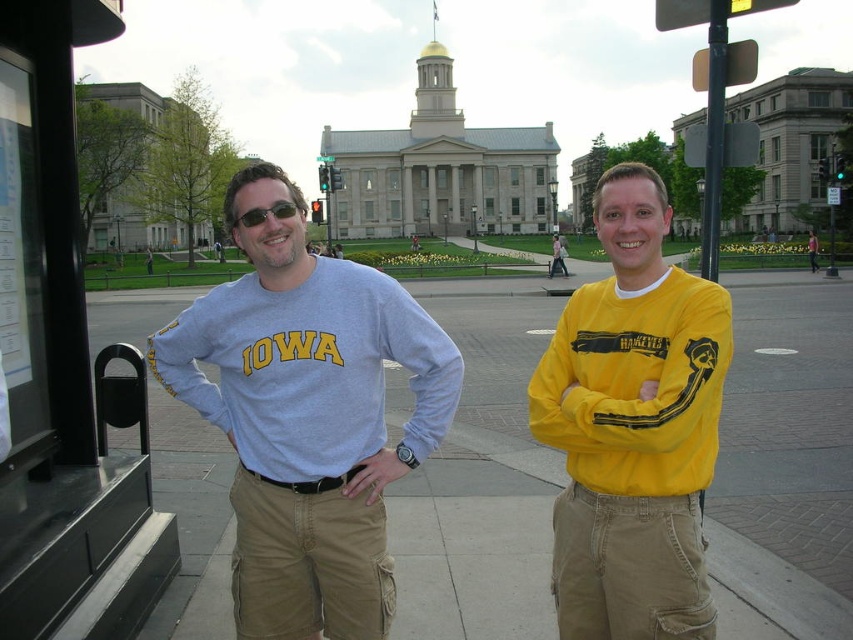
You are standing at the bus stop shelter and want to take a photo of both the point at coordinates [287,577] and the point at [252,225]. Which point will appear larger in your camera view?

Point at coordinates [287,577] will appear larger in the camera view because it is closer to the camera than point at [252,225].

You are a photographer trying to capture a photo of the light blue cotton shirt at center and the matte gray shirt at center. Which shirt should you focus on first if you want to ensure both are in focus, given that your camera can only focus on one plane at a time?

The light blue cotton shirt at center is below the matte gray shirt at center, so you should focus on the matte gray shirt at center first since it is closer to the camera.